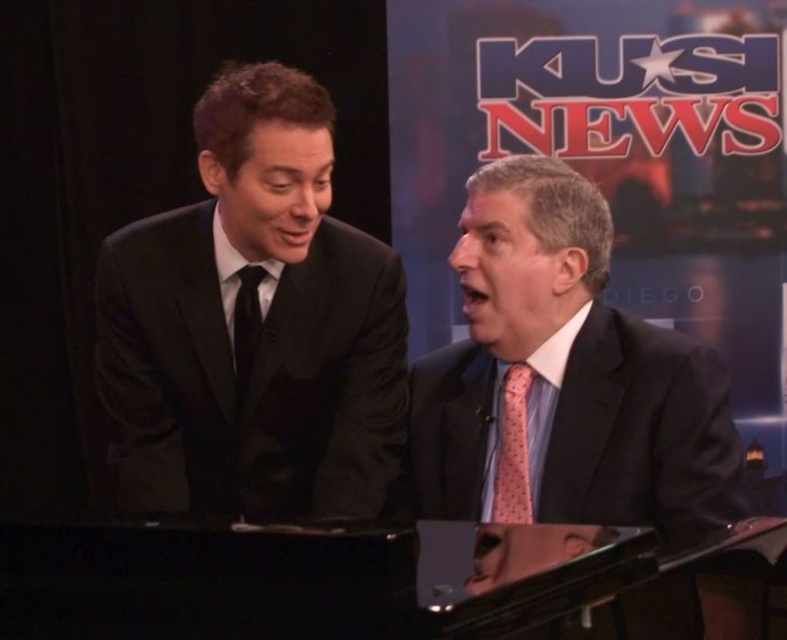
Question: Is pink dotted tie at center behind pink dotted fabric tie at center?

Choices:
 (A) yes
 (B) no

Answer: (B)

Question: Is pink dotted fabric tie at center to the left of black silk tie at left from the viewer's perspective?

Choices:
 (A) no
 (B) yes

Answer: (A)

Question: Estimate the real-world distances between objects in this image. Which object is farther from the black silk tie at left?

Choices:
 (A) pink dotted tie at center
 (B) pink dotted fabric tie at center

Answer: (A)

Question: Can you confirm if satin black suit at left is bigger than pink dotted tie at center?

Choices:
 (A) no
 (B) yes

Answer: (A)

Question: Which of these objects is positioned farthest from the pink dotted fabric tie at center?

Choices:
 (A) pink dotted tie at center
 (B) black silk tie at left
 (C) satin black suit at left

Answer: (B)

Question: Which object appears farthest from the camera in this image?

Choices:
 (A) pink dotted fabric tie at center
 (B) satin black suit at left
 (C) black silk tie at left

Answer: (C)